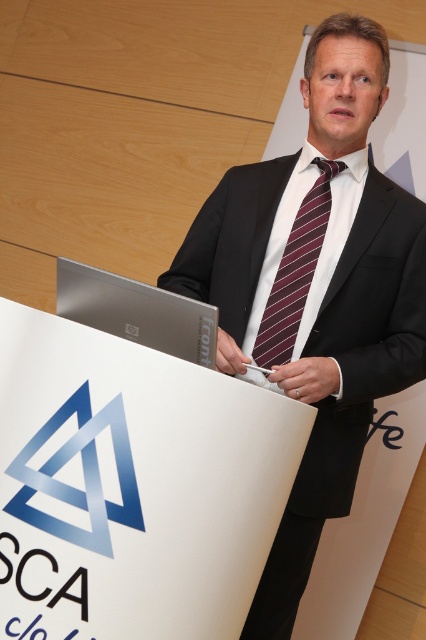
Question: Which point is farther to the camera?

Choices:
 (A) maroon striped tie at center
 (B) white smooth podium at center
 (C) silver metallic laptop at center
 (D) black silk suit at center

Answer: (A)

Question: Is silver metallic laptop at center wider than maroon striped tie at center?

Choices:
 (A) yes
 (B) no

Answer: (A)

Question: Is white smooth podium at center below black silk suit at center?

Choices:
 (A) yes
 (B) no

Answer: (A)

Question: Which of the following is the farthest from the observer?

Choices:
 (A) white smooth podium at center
 (B) maroon striped tie at center
 (C) black silk suit at center

Answer: (B)

Question: Which object is the closest to the maroon striped tie at center?

Choices:
 (A) silver metallic laptop at center
 (B) black silk suit at center

Answer: (B)

Question: Is white smooth podium at center above black silk suit at center?

Choices:
 (A) yes
 (B) no

Answer: (B)